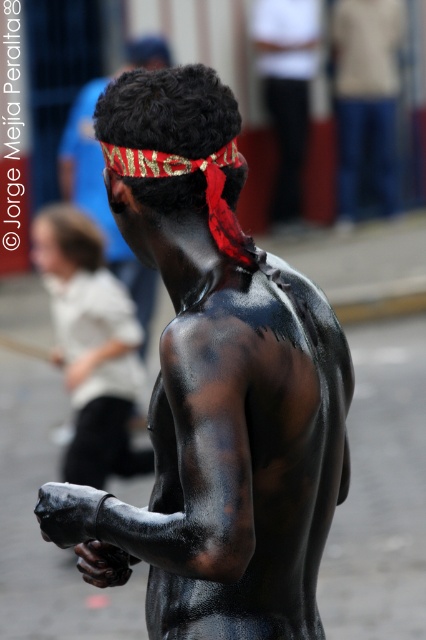
Is blue jeans at center thinner than black matte headband at upper center?

Incorrect, blue jeans at center's width is not less than black matte headband at upper center's.

Does blue jeans at center have a greater height compared to black matte headband at upper center?

Yes.

Does point (368, 65) come in front of point (301, 106)?

No, it is behind (301, 106).

Locate an element on the screen. blue jeans at center is located at coordinates (367, 97).

Can you confirm if blue jeans at center is positioned above shiny black skin at center?

Yes.

Does blue jeans at center appear on the left side of shiny black skin at center?

Incorrect, blue jeans at center is not on the left side of shiny black skin at center.

Identify the location of blue jeans at center. The width and height of the screenshot is (426, 640). (367, 97).

Between point (236, 580) and point (75, 180), which one is positioned behind?

Point (75, 180)

Who is taller, black matte skin at center or shiny black skin at center?

shiny black skin at center

You are a GUI agent. You are given a task and a screenshot of the screen. Output one action in this format:
    pyautogui.click(x=<x>, y=<y>)
    Task: Click on the black matte skin at center
    
    Given the screenshot: What is the action you would take?
    pyautogui.click(x=215, y=387)